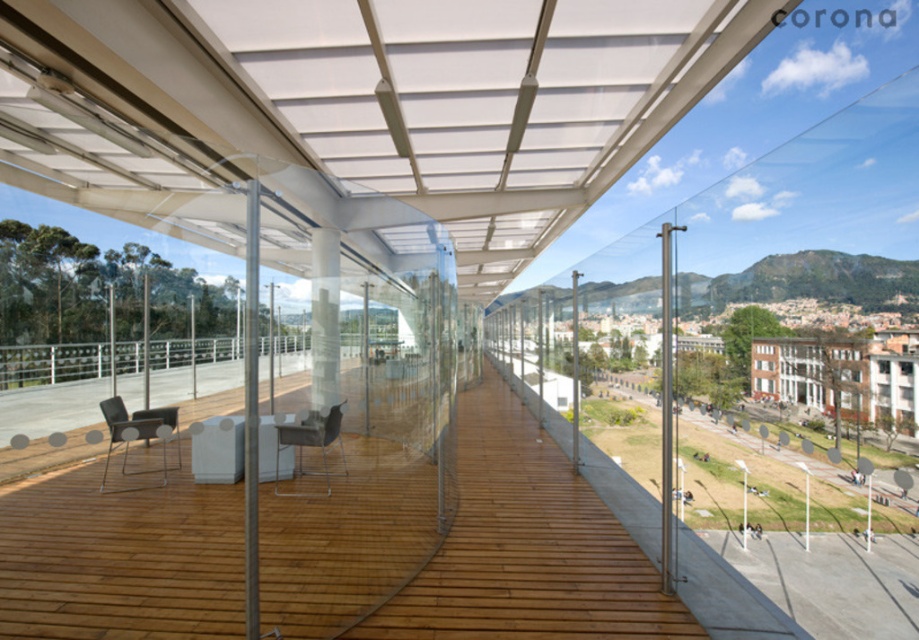
You are standing on the wooden deck at center. Looking towards the curved glass wall, which direction should you turn to face the point marked as point (x=461, y=545)?

Since the wooden deck at center is represented by point (x=461, y=545), you are already facing the point as you are standing on it. No turn is needed.

You are hosting a dinner party and need to seat guests comfortably. Given the space available on the terrace, which chair between the matte black chair at lower left and the metallic silver chair at center would you choose for a guest who prefers a more compact seating option?

The matte black chair at lower left has a smaller size compared to the metallic silver chair at center, so it would be the better choice for a guest who prefers a more compact seating option.

You are planning to place a 1.2 meter tall potted plant on the terrace. Considering the height of the matte black chair at lower left and the metallic silver chair at center, which chair should you place the plant behind so it doesn

The metallic silver chair at center is taller than the matte black chair at lower left, so placing the plant behind the metallic silver chair at center would ensure it is not obstructed by the chair.